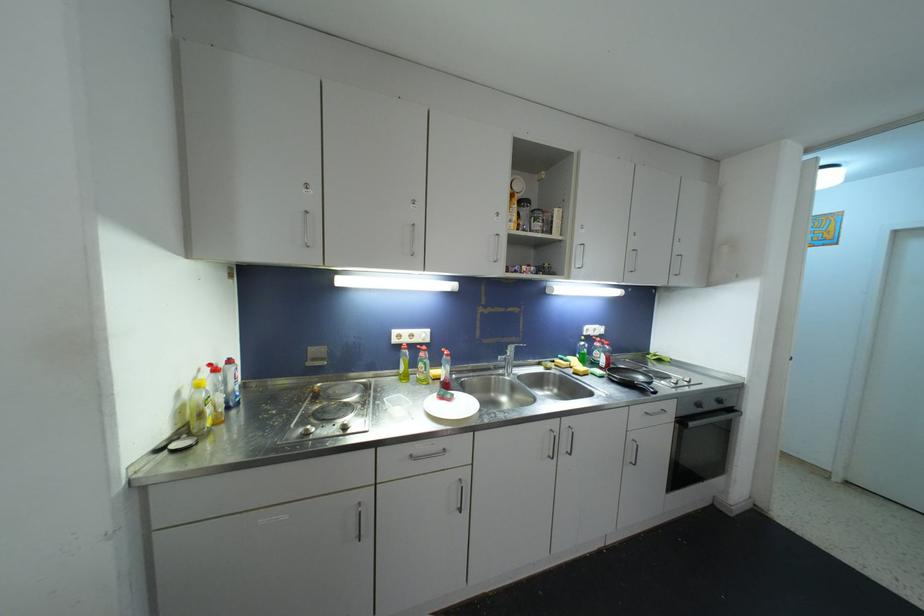
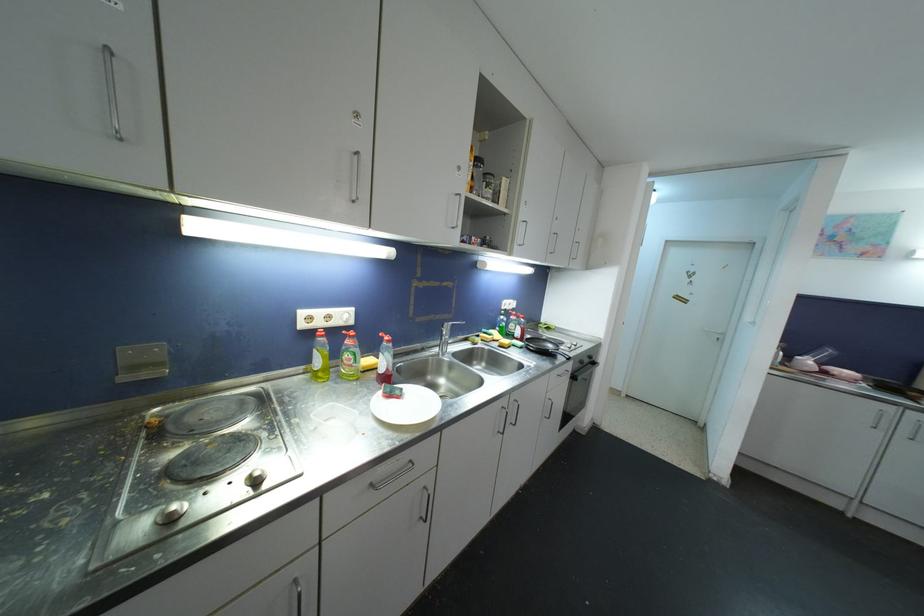
What movement of the cameraman would produce the second image?

The cameraman moved toward left, forward.